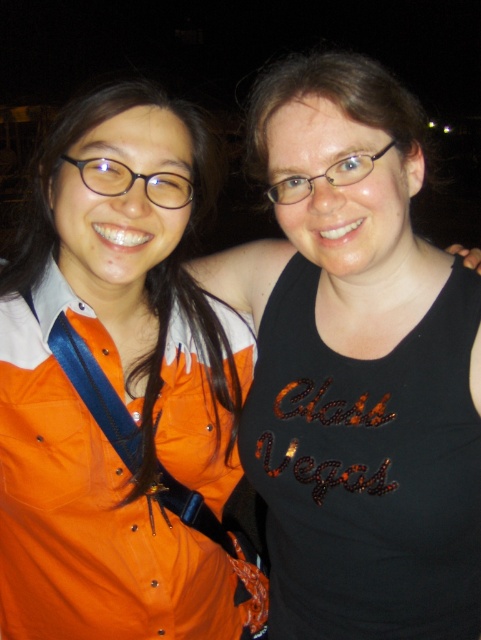
Question: Is black sequined tank top at center closer to camera compared to orange fabric apron at left?

Choices:
 (A) no
 (B) yes

Answer: (B)

Question: Is black sequined tank top at center positioned behind orange fabric apron at left?

Choices:
 (A) no
 (B) yes

Answer: (A)

Question: Is black sequined tank top at center further to the viewer compared to orange fabric apron at left?

Choices:
 (A) yes
 (B) no

Answer: (B)

Question: Based on their relative distances, which object is nearer to the orange fabric shirt at left?

Choices:
 (A) black sequined tank top at center
 (B) orange fabric apron at left

Answer: (B)

Question: Which of these objects is positioned closest to the orange fabric apron at left?

Choices:
 (A) black sequined tank top at center
 (B) orange fabric shirt at left

Answer: (B)

Question: Which point is closer to the camera taking this photo?

Choices:
 (A) (50, 136)
 (B) (430, 572)
 (C) (124, 512)

Answer: (A)